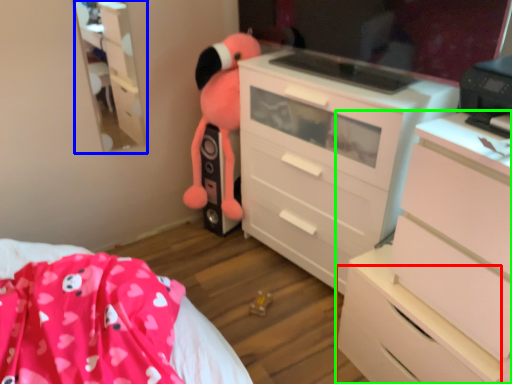
Question: Estimate the real-world distances between objects in this image. Which object is closer to drawer (highlighted by a red box), tv cabinet (highlighted by a blue box) or chest of drawers (highlighted by a green box)?

Choices:
 (A) tv cabinet
 (B) chest of drawers

Answer: (B)